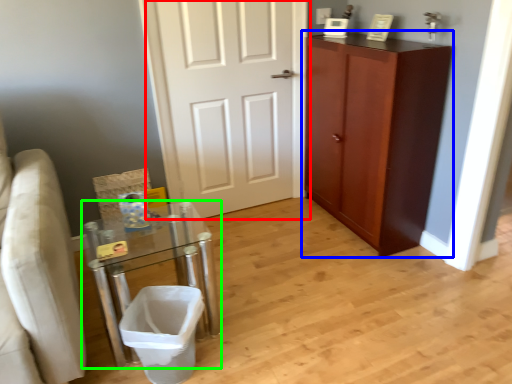
Question: Which is farther away from door (highlighted by a red box)? cabinetry (highlighted by a blue box) or table (highlighted by a green box)?

Choices:
 (A) cabinetry
 (B) table

Answer: (B)